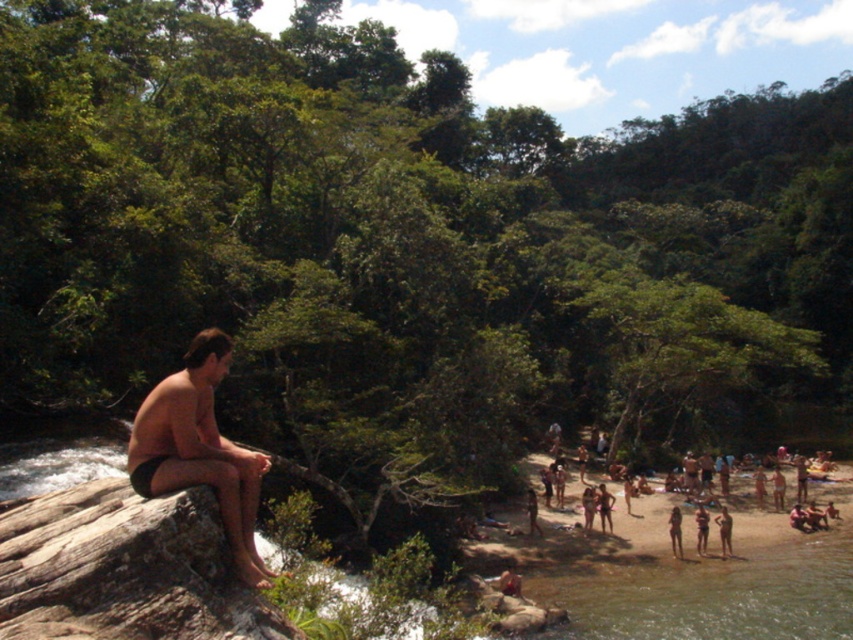
You are a photographer trying to capture the man in the image. You notice the matte black shorts at left and the tan skin human at lower right. Which object is positioned more to the left in the frame?

The matte black shorts at left is positioned on the left side of the tan skin human at lower right, so it is more to the left in the frame.